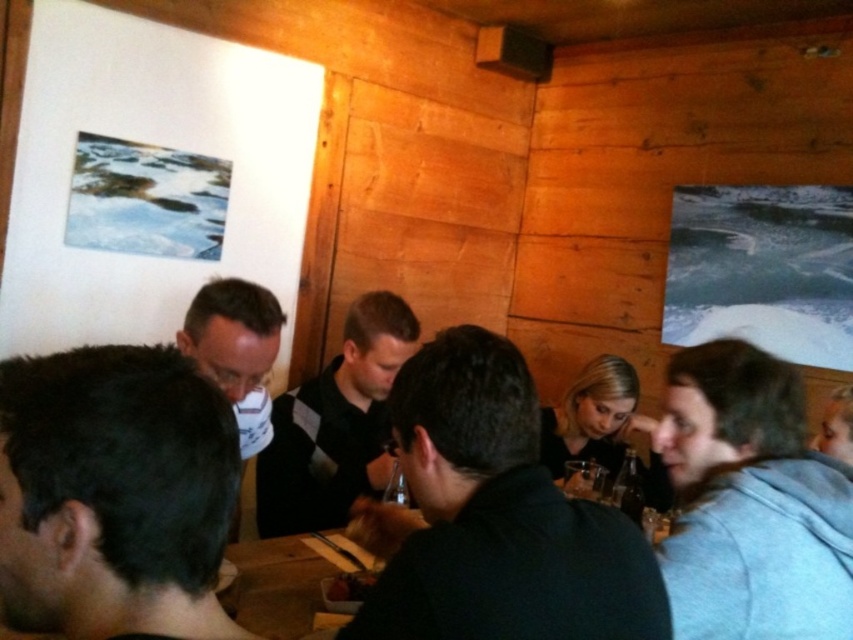
Question: Among these objects, which one is nearest to the camera?

Choices:
 (A) dark brown hair at lower left
 (B) wooden table at center
 (C) dark glass bottle at lower right
 (D) black sweater at center

Answer: (A)

Question: Is dark gray shirt at center to the right of wooden table at center from the viewer's perspective?

Choices:
 (A) no
 (B) yes

Answer: (B)

Question: Which object is the closest to the dark gray shirt at center?

Choices:
 (A) matte black shirt at center
 (B) clear glass at center
 (C) wooden table at center
 (D) black sweater at center

Answer: (C)

Question: Which of the following is the closest to the observer?

Choices:
 (A) (132, 406)
 (B) (428, 596)
 (C) (596, 472)

Answer: (A)

Question: Does dark brown hair at lower left appear on the right side of gray hoodie at lower right?

Choices:
 (A) yes
 (B) no

Answer: (B)

Question: Can you confirm if dark glass bottle at lower right is positioned below wooden table at center?

Choices:
 (A) no
 (B) yes

Answer: (B)